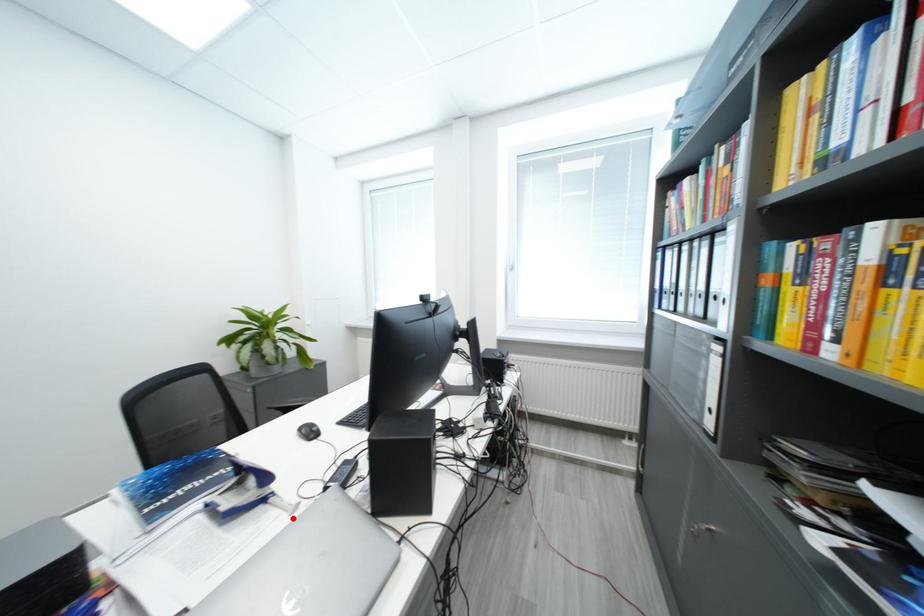
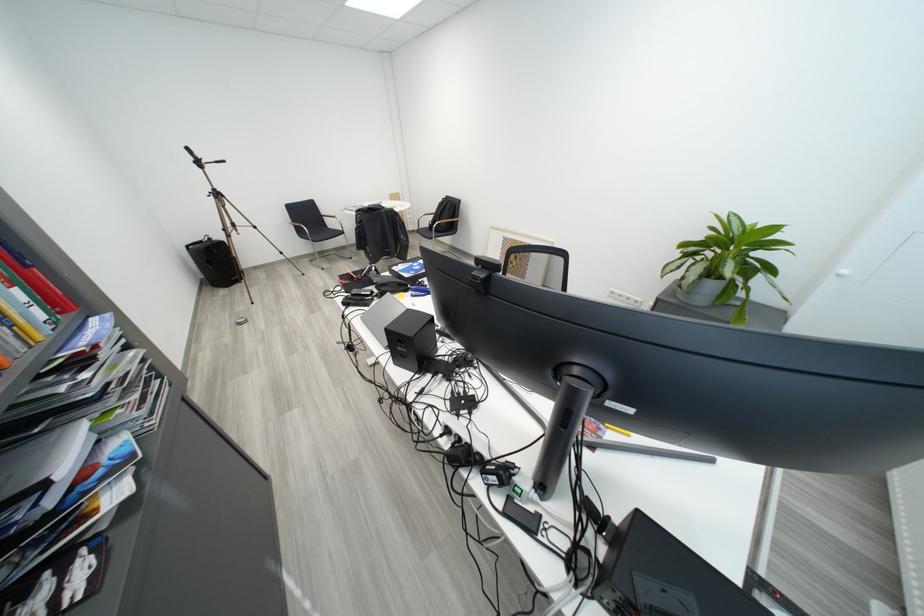
Question: I am providing you with two images of the same scene from different viewpoints. A red point is marked on the first image. At the location where the point appears in image 1, is it still visible in image 2?

Choices:
 (A) Yes
 (B) No

Answer: (B)